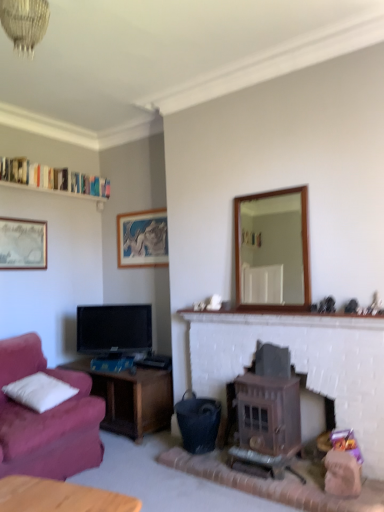
In order to face matte wooden picture frame at upper center, the second picture frame viewed from the left, should I rotate leftwards or rightwards?

It's best to rotate left around 6.777 degrees.

Describe the element at coordinates (23, 244) in the screenshot. I see `matte silver picture frame at upper left, placed as the second picture frame when sorted from right to left` at that location.

This screenshot has width=384, height=512. Identify the location of wooden stove at center. (301, 364).

What is the approximate height of white brick fireplace at center?

white brick fireplace at center is 5.44 inches tall.

Measure the distance between crystal glass chandelier at upper center and camera.

crystal glass chandelier at upper center is 1.46 meters away from camera.

Locate an element on the screen. matte black tv at left is located at coordinates (114, 329).

Can you tell me how much white fluffy pillow at left and white brick fireplace at center differ in facing direction?

The facing directions of white fluffy pillow at left and white brick fireplace at center are 0.512 degrees apart.

Does point (50, 393) come behind point (333, 325)?

Yes.

Is white fluffy pillow at left taller or shorter than white brick fireplace at center?

In the image, white fluffy pillow at left appears to be taller than white brick fireplace at center.

Is white brick fireplace at center smaller than matte wooden picture frame at upper center, the second picture frame viewed from the left?

No, white brick fireplace at center is not smaller than matte wooden picture frame at upper center, the second picture frame viewed from the left.

This screenshot has width=384, height=512. There is a white brick fireplace at center. Find the location of `the 2nd picture frame above it (from the image's perspective)`. the 2nd picture frame above it (from the image's perspective) is located at coordinates (142, 239).

Is white brick fireplace at center positioned far away from matte wooden picture frame at upper center, the second picture frame in the front-to-back sequence?

Indeed, white brick fireplace at center is not near matte wooden picture frame at upper center, the second picture frame in the front-to-back sequence.

Is white brick fireplace at center further to camera compared to matte wooden picture frame at upper center, the first picture frame viewed from the right?

No, white brick fireplace at center is in front of matte wooden picture frame at upper center, the first picture frame viewed from the right.

Does point (26, 46) appear closer or farther from the camera than point (95, 312)?

Point (26, 46) is positioned closer to the camera compared to point (95, 312).

Is the depth of crystal glass chandelier at upper center greater than that of matte black tv at left?

No, it is not.

Are crystal glass chandelier at upper center and matte black tv at left far apart?

crystal glass chandelier at upper center is far away from matte black tv at left.

Does crystal glass chandelier at upper center turn towards matte black tv at left?

No, crystal glass chandelier at upper center is not turned towards matte black tv at left.

Locate an element on the screen. Image resolution: width=384 pixels, height=512 pixels. mantle below the wooden-framed mirror at center-right (from the image's perspective) is located at coordinates (283, 318).

From the image's perspective, who appears lower, white brick fireplace at center or wooden-framed mirror at center-right?

white brick fireplace at center, from the image's perspective.

Does white brick fireplace at center have a greater height compared to wooden-framed mirror at center-right?

No, white brick fireplace at center is not taller than wooden-framed mirror at center-right.

Considering the points (264, 321) and (301, 263), which point is behind, point (264, 321) or point (301, 263)?

The point (301, 263) is more distant.

From the picture: In terms of size, does matte black tv at left appear bigger or smaller than brown wooden wood burning stove at center-right?

Considering their sizes, matte black tv at left takes up less space than brown wooden wood burning stove at center-right.

Considering the relative sizes of matte black tv at left and brown wooden wood burning stove at center-right in the image provided, is matte black tv at left thinner than brown wooden wood burning stove at center-right?

Yes.

Can brown wooden wood burning stove at center-right be found inside matte black tv at left?

No, matte black tv at left does not contain brown wooden wood burning stove at center-right.

Can you confirm if matte silver picture frame at upper left, placed as the second picture frame when sorted from right to left, is shorter than matte black tv at left?

Indeed, matte silver picture frame at upper left, placed as the second picture frame when sorted from right to left, has a lesser height compared to matte black tv at left.

Does matte silver picture frame at upper left, placed as the second picture frame when sorted from right to left, have a lesser width compared to matte black tv at left?

Yes.

In the image, is matte silver picture frame at upper left, which ranks as the 2th picture frame in back-to-front order, positioned in front of or behind matte black tv at left?

Clearly, matte silver picture frame at upper left, which ranks as the 2th picture frame in back-to-front order, is in front of matte black tv at left.

How different are the orientations of matte silver picture frame at upper left, which ranks as the 2th picture frame in back-to-front order, and matte black tv at left in degrees?

matte silver picture frame at upper left, which ranks as the 2th picture frame in back-to-front order, and matte black tv at left are facing 54.3 degrees away from each other.

Can you confirm if crystal glass chandelier at upper center is smaller than brown wooden wood burning stove at center-right?

Yes, crystal glass chandelier at upper center is smaller than brown wooden wood burning stove at center-right.

Is crystal glass chandelier at upper center to the left or to the right of brown wooden wood burning stove at center-right in the image?

crystal glass chandelier at upper center is positioned on brown wooden wood burning stove at center-right's left side.

Can you confirm if crystal glass chandelier at upper center is thinner than brown wooden wood burning stove at center-right?

Correct, the width of crystal glass chandelier at upper center is less than that of brown wooden wood burning stove at center-right.

Identify the location of mantle above the white fluffy pillow at left (from the image's perspective). This screenshot has width=384, height=512. (283, 318).

Find the location of a particular element. This screenshot has width=384, height=512. the 2nd picture frame behind the white brick fireplace at center, starting your count from the anchor is located at coordinates (142, 239).

Considering their positions, is matte wooden picture frame at upper center, the second picture frame in the front-to-back sequence, positioned closer to crystal glass chandelier at upper center than white fluffy pillow at left?

The object closer to crystal glass chandelier at upper center is white fluffy pillow at left.

Considering their positions, is wooden-framed mirror at center-right positioned closer to white fluffy pillow at left than wooden stove at center?

wooden stove at center is positioned closer to the anchor white fluffy pillow at left.

Estimate the real-world distances between objects in this image. Which object is further from brown wooden wood burning stove at center-right, matte wooden picture frame at upper center, the second picture frame in the front-to-back sequence, or crystal glass chandelier at upper center?

Among the two, crystal glass chandelier at upper center is located further to brown wooden wood burning stove at center-right.

Considering their positions, is white wooden shelf at upper left positioned further to white brick fireplace at center than wooden stove at center?

Based on the image, white wooden shelf at upper left appears to be further to white brick fireplace at center.

Estimate the real-world distances between objects in this image. Which object is closer to crystal glass chandelier at upper center, matte black tv at left or matte wooden picture frame at upper center, the first picture frame viewed from the right?

Based on the image, matte black tv at left appears to be nearer to crystal glass chandelier at upper center.

Based on their spatial positions, is wooden-framed mirror at center-right or matte wooden picture frame at upper center, the first picture frame viewed from the right, closer to white wooden shelf at upper left?

matte wooden picture frame at upper center, the first picture frame viewed from the right, is positioned closer to the anchor white wooden shelf at upper left.

Looking at the image, which one is located further to white brick fireplace at center, matte black tv at left or matte silver picture frame at upper left, which ranks as the 2th picture frame in back-to-front order?

matte silver picture frame at upper left, which ranks as the 2th picture frame in back-to-front order, is positioned further to the anchor white brick fireplace at center.

When comparing their distances from matte black tv at left, does matte wooden picture frame at upper center, the second picture frame in the front-to-back sequence, or white fluffy pillow at left seem closer?

matte wooden picture frame at upper center, the second picture frame in the front-to-back sequence, is positioned closer to the anchor matte black tv at left.

Where is `picture frame between crystal glass chandelier at upper center and matte black tv at left in the front-back direction`? The image size is (384, 512). picture frame between crystal glass chandelier at upper center and matte black tv at left in the front-back direction is located at coordinates (23, 244).

The height and width of the screenshot is (512, 384). Identify the location of mirror located between crystal glass chandelier at upper center and matte silver picture frame at upper left, placed as the second picture frame when sorted from right to left, in the depth direction. (272, 249).

I want to click on pillow between crystal glass chandelier at upper center and matte silver picture frame at upper left, which ranks as the 2th picture frame in back-to-front order, along the z-axis, so click(x=39, y=391).

This screenshot has height=512, width=384. I want to click on mantle between white fluffy pillow at left and wooden-framed mirror at center-right from left to right, so click(283, 318).